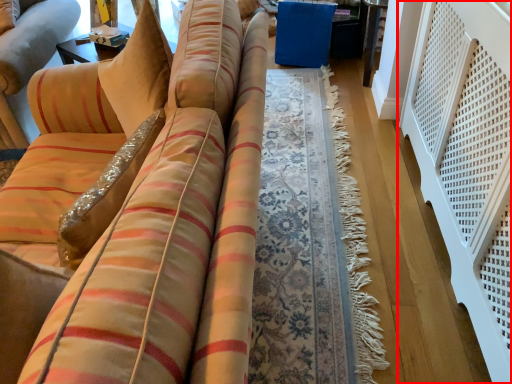
Question: From the image's perspective, what is the correct spatial relationship of balustrade (annotated by the red box) in relation to table?

Choices:
 (A) below
 (B) above

Answer: (A)